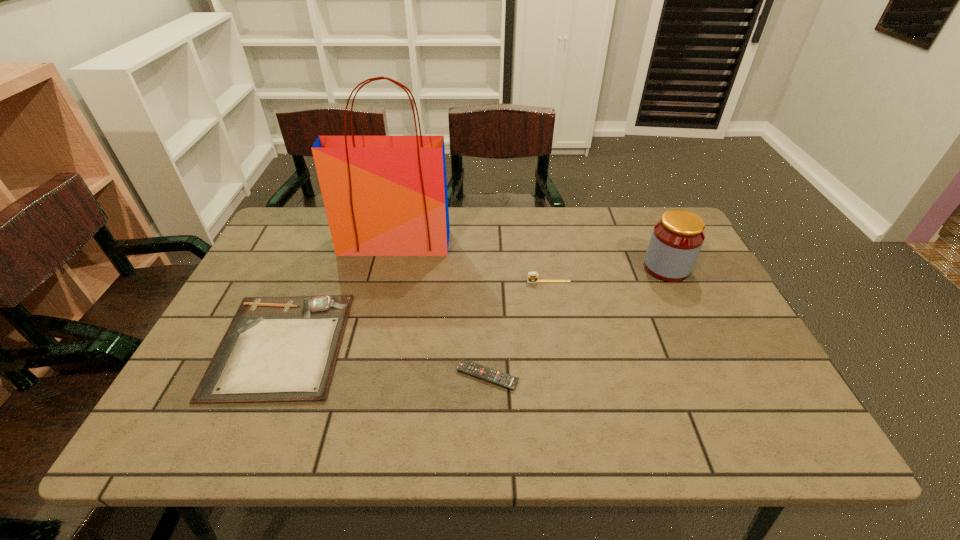
Image resolution: width=960 pixels, height=540 pixels. Identify the location of the tallest object. (384, 195).

The width and height of the screenshot is (960, 540). Find the location of `the fourth shortest object`. the fourth shortest object is located at coordinates (677, 238).

Image resolution: width=960 pixels, height=540 pixels. I want to click on the rightmost object, so [x=677, y=238].

Locate an element on the screen. Image resolution: width=960 pixels, height=540 pixels. tape measure is located at coordinates (532, 277).

This screenshot has height=540, width=960. Find the location of `the third tallest object`. the third tallest object is located at coordinates (532, 277).

This screenshot has width=960, height=540. Find the location of `clipboard`. clipboard is located at coordinates (276, 349).

Locate an element on the screen. the third object from left to right is located at coordinates (507, 381).

Locate an element on the screen. This screenshot has height=540, width=960. the shortest object is located at coordinates (507, 381).

The image size is (960, 540). What are the coordinates of `vacant space located 0.370m on the handle side of the shopping bag` in the screenshot? It's located at (368, 358).

You are a GUI agent. You are given a task and a screenshot of the screen. Output one action in this format:
    pyautogui.click(x=<x>, y=<y>)
    Task: Click on the blank area located on the left of the jar
    This screenshot has width=960, height=540.
    Given the screenshot: What is the action you would take?
    pyautogui.click(x=540, y=268)